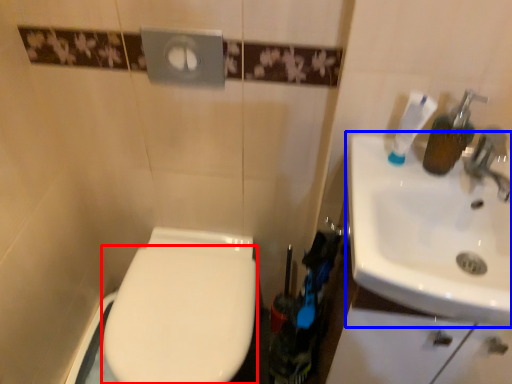
Question: Among these objects, which one is farthest to the camera, bidet (highlighted by a red box) or sink (highlighted by a blue box)?

Choices:
 (A) bidet
 (B) sink

Answer: (A)